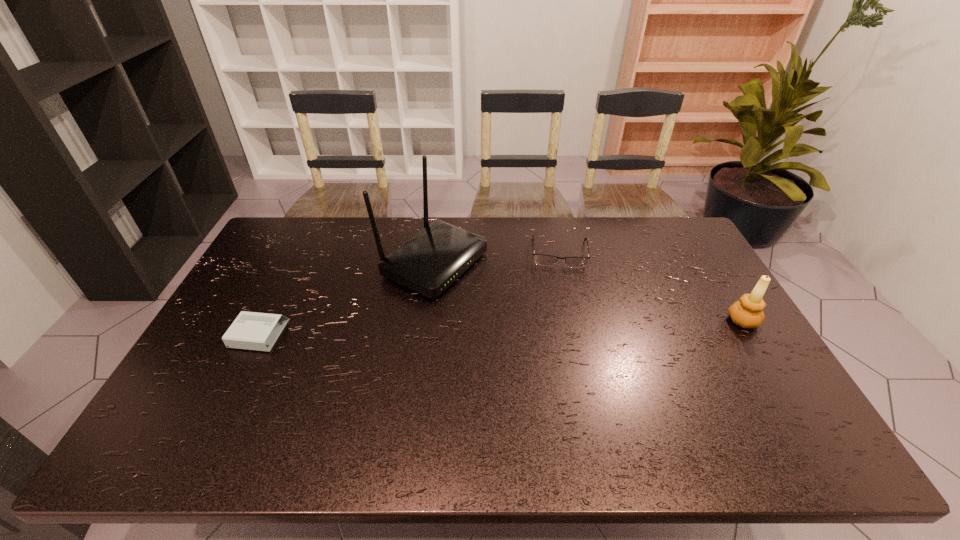
In the image, there is a desktop. In order to click on vacant space at the left edge in this screenshot , I will do `click(267, 274)`.

Locate an element on the screen. This screenshot has height=540, width=960. free space at the right edge of the desktop is located at coordinates (701, 297).

The height and width of the screenshot is (540, 960). Identify the location of blank space at the far left corner of the desktop. (293, 243).

You are a GUI agent. You are given a task and a screenshot of the screen. Output one action in this format:
    pyautogui.click(x=<x>, y=<y>)
    Task: Click on the blank space at the far right corner
    This screenshot has width=960, height=540.
    Given the screenshot: What is the action you would take?
    pyautogui.click(x=670, y=218)

Where is `free spot at the near right corner of the desktop`? The height and width of the screenshot is (540, 960). free spot at the near right corner of the desktop is located at coordinates (755, 388).

The width and height of the screenshot is (960, 540). In order to click on unoccupied position between the candle_holder and the alarm clock in this screenshot , I will do `click(501, 327)`.

This screenshot has width=960, height=540. I want to click on vacant area that lies between the third object from left to right and the leftmost object, so click(x=410, y=293).

Image resolution: width=960 pixels, height=540 pixels. I want to click on vacant area between the rightmost object and the third object from left to right, so click(651, 286).

Identify the location of free space that is in between the candle_holder and the spectacles. The image size is (960, 540). (651, 286).

I want to click on free space between the tallest object and the rightmost object, so click(x=588, y=292).